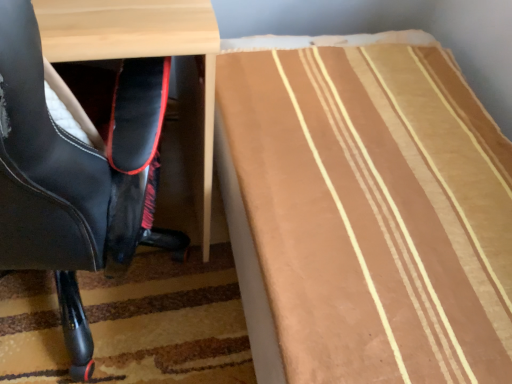
Locate an element on the screen. The height and width of the screenshot is (384, 512). black leather chair at left is located at coordinates (75, 177).

What do you see at coordinates (75, 177) in the screenshot?
I see `black leather chair at left` at bounding box center [75, 177].

Find the location of a particular element. This screenshot has width=512, height=384. brown striped fabric at lower right is located at coordinates (365, 210).

What do you see at coordinates (365, 210) in the screenshot? I see `brown striped fabric at lower right` at bounding box center [365, 210].

At what (x,y) coordinates should I click in order to perform the action: click on black leather chair at left. Please return your answer as a coordinate pair (x, y). Looking at the image, I should click on (75, 177).

Based on the photo, does black leather chair at left appear on the right side of brown striped fabric at lower right?

In fact, black leather chair at left is to the left of brown striped fabric at lower right.

Is the position of black leather chair at left more distant than that of brown striped fabric at lower right?

No, black leather chair at left is in front of brown striped fabric at lower right.

Between point (75, 66) and point (247, 210), which one is positioned behind?

Positioned behind is point (75, 66).

From the image's perspective, which one is positioned lower, black leather chair at left or brown striped fabric at lower right?

brown striped fabric at lower right appears lower in the image.

From a real-world perspective, is black leather chair at left physically below brown striped fabric at lower right?

No, from a real-world perspective, black leather chair at left is not beneath brown striped fabric at lower right.

Which object is wider, black leather chair at left or brown striped fabric at lower right?

brown striped fabric at lower right.

Considering the relative sizes of black leather chair at left and brown striped fabric at lower right in the image provided, is black leather chair at left shorter than brown striped fabric at lower right?

Incorrect, the height of black leather chair at left does not fall short of that of brown striped fabric at lower right.

Does black leather chair at left have a larger size compared to brown striped fabric at lower right?

Actually, black leather chair at left might be smaller than brown striped fabric at lower right.

Choose the correct answer: Is black leather chair at left inside brown striped fabric at lower right or outside it?

black leather chair at left cannot be found inside brown striped fabric at lower right.

Would you consider black leather chair at left to be distant from brown striped fabric at lower right?

black leather chair at left is near brown striped fabric at lower right, not far away.

Consider the image. Could you tell me if black leather chair at left is facing brown striped fabric at lower right?

No, black leather chair at left is not aimed at brown striped fabric at lower right.

How many degrees apart are the facing directions of black leather chair at left and brown striped fabric at lower right?

The facing directions of black leather chair at left and brown striped fabric at lower right are 91.3 degrees apart.

Find the location of a particular element. The height and width of the screenshot is (384, 512). chair on the left of brown striped fabric at lower right is located at coordinates (75, 177).

Considering the positions of objects brown striped fabric at lower right and black leather chair at left in the image provided, who is more to the right, brown striped fabric at lower right or black leather chair at left?

brown striped fabric at lower right is more to the right.

Who is more distant, brown striped fabric at lower right or black leather chair at left?

Positioned behind is brown striped fabric at lower right.

Does point (433, 181) come behind point (122, 232)?

Yes.

From the image's perspective, which is below, brown striped fabric at lower right or black leather chair at left?

brown striped fabric at lower right appears lower in the image.

From a real-world perspective, who is located lower, brown striped fabric at lower right or black leather chair at left?

brown striped fabric at lower right.

Between brown striped fabric at lower right and black leather chair at left, which one has larger width?

brown striped fabric at lower right.

Does brown striped fabric at lower right have a greater height compared to black leather chair at left?

Incorrect, the height of brown striped fabric at lower right is not larger of that of black leather chair at left.

Which of these two, brown striped fabric at lower right or black leather chair at left, is bigger?

brown striped fabric at lower right.

Is brown striped fabric at lower right not inside black leather chair at left?

Yes, brown striped fabric at lower right is not within black leather chair at left.

Is brown striped fabric at lower right touching black leather chair at left?

No, brown striped fabric at lower right is not with black leather chair at left.

Does brown striped fabric at lower right turn towards black leather chair at left?

Yes, brown striped fabric at lower right is turned towards black leather chair at left.

I want to click on chair in front of the brown striped fabric at lower right, so click(75, 177).

Locate an element on the screen. The width and height of the screenshot is (512, 384). chair to the left of brown striped fabric at lower right is located at coordinates (75, 177).

I want to click on chair that appears above the brown striped fabric at lower right (from a real-world perspective), so [75, 177].